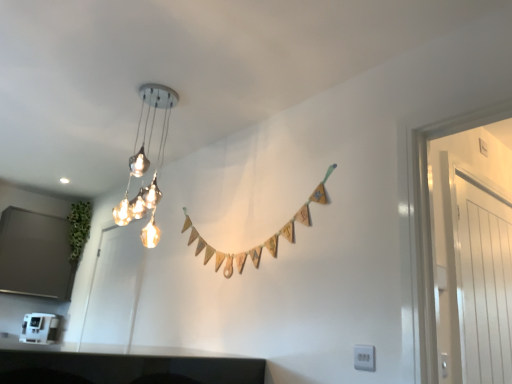
Question: Considering the relative sizes of matte white door at left, which is the 1th glass door in back-to-front order, and white plastic coffee machine at lower left in the image provided, is matte white door at left, which is the 1th glass door in back-to-front order, smaller than white plastic coffee machine at lower left?

Choices:
 (A) yes
 (B) no

Answer: (B)

Question: Is matte white door at left, which ranks as the first glass door in left-to-right order, placed right next to white plastic coffee machine at lower left?

Choices:
 (A) no
 (B) yes

Answer: (A)

Question: From the image's perspective, is matte white door at left, which is the 1th glass door in back-to-front order, above white plastic coffee machine at lower left?

Choices:
 (A) yes
 (B) no

Answer: (A)

Question: Can you confirm if matte white door at left, positioned as the second glass door in front-to-back order, is taller than white plastic coffee machine at lower left?

Choices:
 (A) no
 (B) yes

Answer: (B)

Question: Is the position of matte white door at left, which ranks as the first glass door in left-to-right order, less distant than that of white plastic coffee machine at lower left?

Choices:
 (A) yes
 (B) no

Answer: (A)

Question: Can you confirm if matte white door at left, which ranks as the first glass door in left-to-right order, is bigger than white plastic coffee machine at lower left?

Choices:
 (A) no
 (B) yes

Answer: (B)

Question: Does metallic glass chandelier at upper center have a lesser width compared to white plastic coffee machine at lower left?

Choices:
 (A) yes
 (B) no

Answer: (A)

Question: Is metallic glass chandelier at upper center surrounding white plastic coffee machine at lower left?

Choices:
 (A) no
 (B) yes

Answer: (A)

Question: Does metallic glass chandelier at upper center turn towards white plastic coffee machine at lower left?

Choices:
 (A) no
 (B) yes

Answer: (A)

Question: Does metallic glass chandelier at upper center lie behind white plastic coffee machine at lower left?

Choices:
 (A) no
 (B) yes

Answer: (A)

Question: Does metallic glass chandelier at upper center have a lesser height compared to white plastic coffee machine at lower left?

Choices:
 (A) no
 (B) yes

Answer: (A)

Question: From a real-world perspective, is metallic glass chandelier at upper center under white plastic coffee machine at lower left?

Choices:
 (A) yes
 (B) no

Answer: (B)

Question: Considering the relative sizes of matte white door at left, which ranks as the first glass door in left-to-right order, and white glossy door at right, which is counted as the first glass door, starting from the right, in the image provided, is matte white door at left, which ranks as the first glass door in left-to-right order, bigger than white glossy door at right, which is counted as the first glass door, starting from the right,?

Choices:
 (A) no
 (B) yes

Answer: (B)